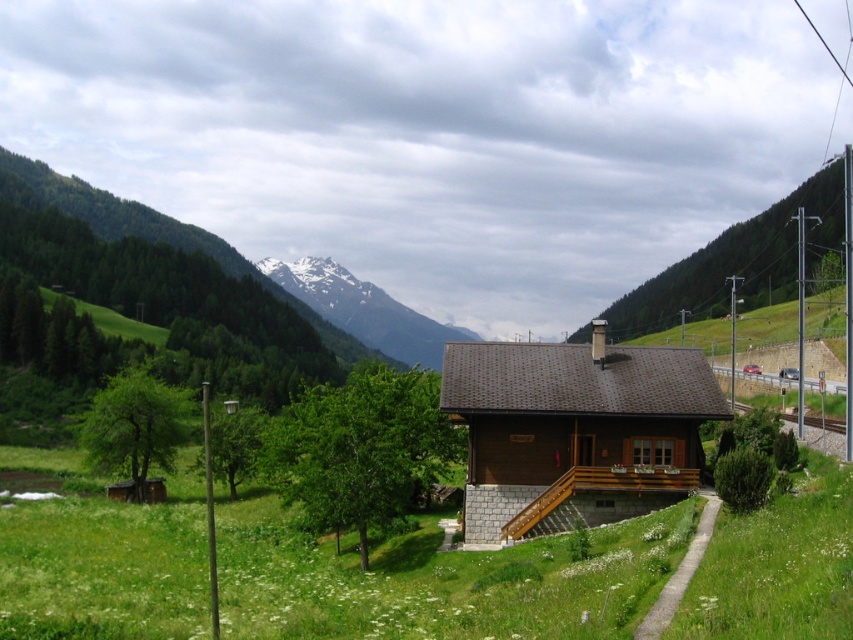
In the scene shown: You are standing at the edge of the valley and want to take a photo of the chalet. To ensure the green grassy at lower center is centered in your photo, where should you position your camera relative to the chalet?

To center the green grassy at lower center in your photo, position your camera so that it is aligned with the coordinates point (x=437, y=582) relative to the chalet.